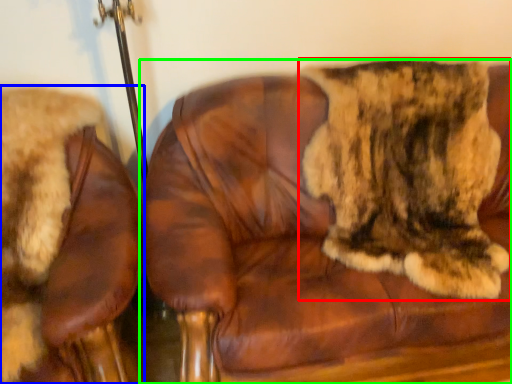
Question: Which object is the farthest from cat (highlighted by a red box)? Choose among these: chair (highlighted by a blue box) or chair (highlighted by a green box).

Choices:
 (A) chair
 (B) chair

Answer: (A)